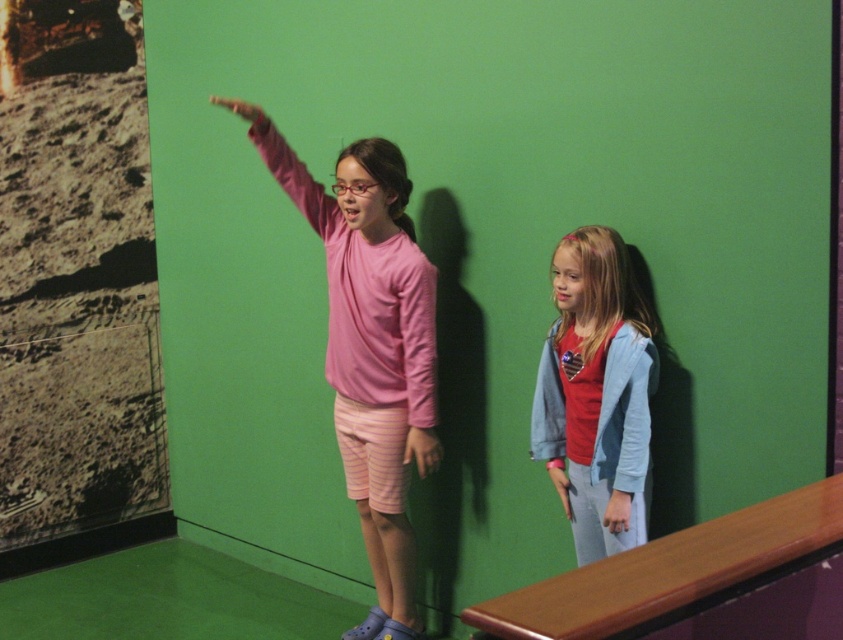
You are a fashion designer observing the two girls. The denim jacket at right and the light blue fabric at lower right are part of their outfits. Which clothing item is positioned higher on the body?

The denim jacket at right is positioned higher on the body than the light blue fabric at lower right because it is above it.

You are a tailor measuring clothing items in a store. You have a light blue denim jacket at lower right and a pink fabric arm at upper center. Which item requires a larger measurement tape size?

The light blue denim jacket at lower right requires a larger measurement tape size because it has a larger size compared to the pink fabric arm at upper center.